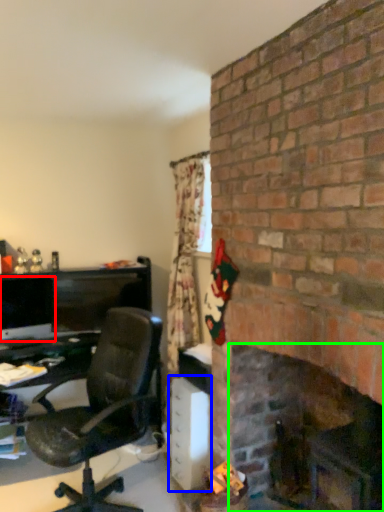
Question: Estimate the real-world distances between objects in this image. Which object is farther from computer monitor (highlighted by a red box), file cabinet (highlighted by a blue box) or fireplace (highlighted by a green box)?

Choices:
 (A) file cabinet
 (B) fireplace

Answer: (B)